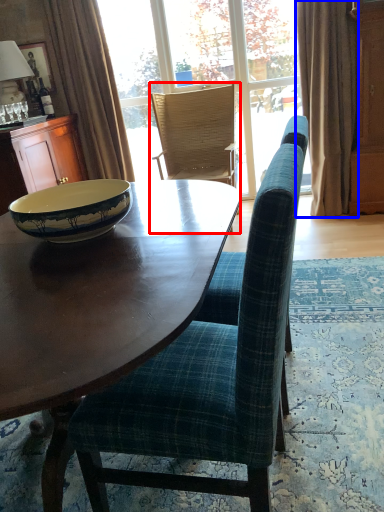
Question: Among these objects, which one is farthest to the camera, chair (highlighted by a red box) or curtain (highlighted by a blue box)?

Choices:
 (A) chair
 (B) curtain

Answer: (A)